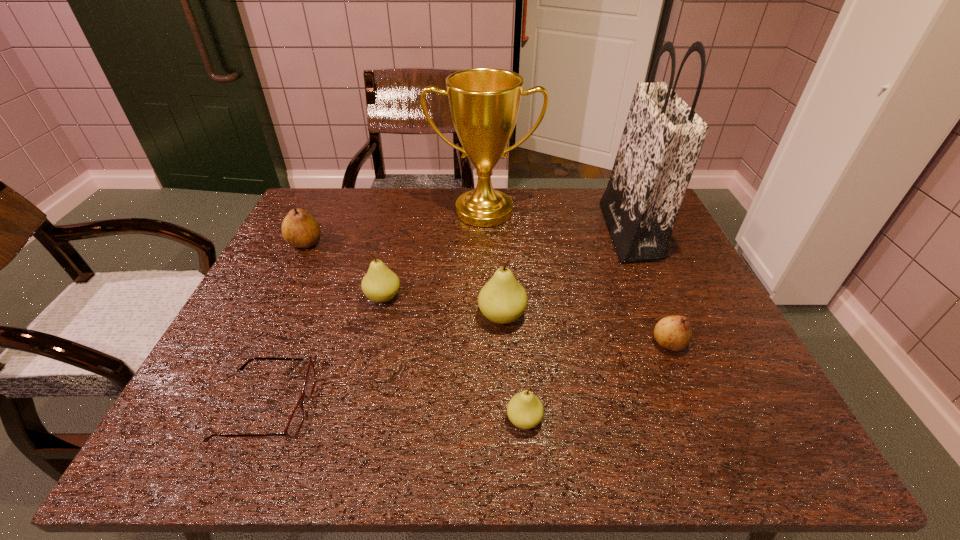
This screenshot has height=540, width=960. Find the location of `free space located on the right of the farther brown pear`. free space located on the right of the farther brown pear is located at coordinates (459, 244).

The width and height of the screenshot is (960, 540). I want to click on vacant space located 0.060m on the front of the second smallest green pear, so click(375, 329).

Locate an element on the screen. Image resolution: width=960 pixels, height=540 pixels. blank space located on the right of the nearer brown pear is located at coordinates (736, 343).

I want to click on vacant space located 0.240m on the back of the nearest green pear, so click(x=516, y=314).

Identify the location of vacant space located 0.400m on the lenses of the shortest object. (518, 407).

The image size is (960, 540). Find the location of `shopping bag located at the far edge`. shopping bag located at the far edge is located at coordinates (662, 139).

Locate an element on the screen. This screenshot has width=960, height=540. award that is at the far edge is located at coordinates (484, 103).

The width and height of the screenshot is (960, 540). Identify the location of pear positioned at the near edge. (525, 410).

At what (x,y) coordinates should I click in order to perform the action: click on spectacles that is at the near edge. Please return your answer as a coordinate pair (x, y). The image size is (960, 540). Looking at the image, I should click on (294, 424).

Find the location of a particular element. This screenshot has height=540, width=960. pear present at the left edge is located at coordinates (299, 229).